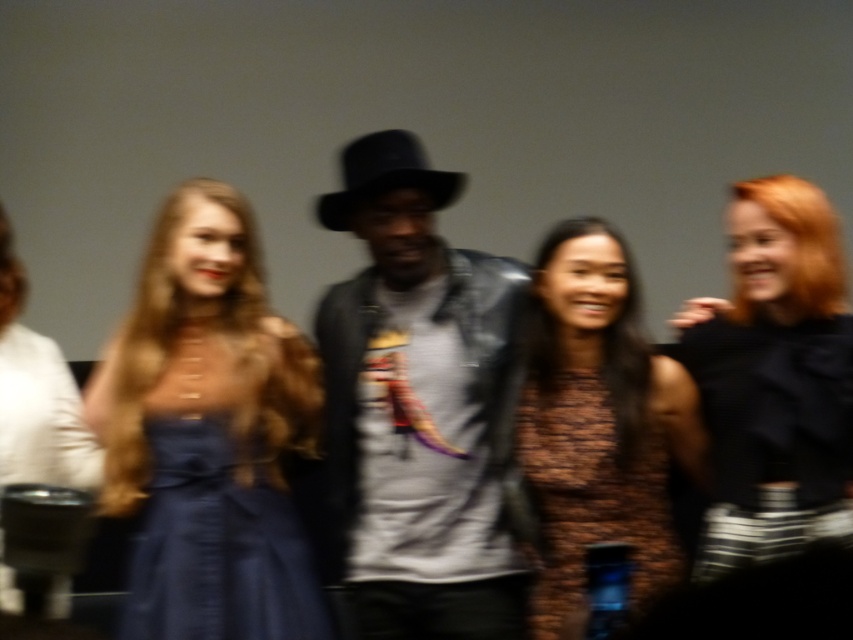
Who is higher up, denim jacket at center or satin blue dress at center?

denim jacket at center

Which is more to the right, denim jacket at center or satin blue dress at center?

From the viewer's perspective, denim jacket at center appears more on the right side.

Does point (473, 624) come farther from viewer compared to point (289, 593)?

That is True.

This screenshot has height=640, width=853. In order to click on denim jacket at center in this screenshot , I will do `click(422, 410)`.

Does denim jacket at center lie in front of black satin dress at right?

No, it is behind black satin dress at right.

Does denim jacket at center have a smaller size compared to black satin dress at right?

No.

Measure the distance between point (387, 483) and camera.

2.14 meters

I want to click on denim jacket at center, so click(422, 410).

Is shiny blue dress at left closer to the viewer compared to black satin dress at right?

No, it is behind black satin dress at right.

Between point (279, 628) and point (808, 182), which one is positioned in front?

Point (279, 628) is more forward.

Identify the location of shiny blue dress at left. (207, 433).